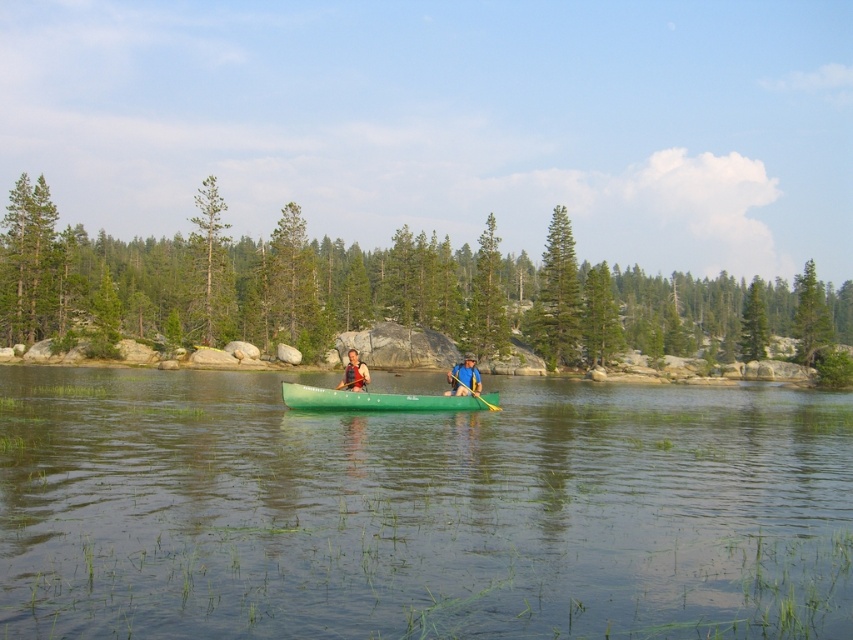
Question: Does green plastic canoe at center come in front of matte green canoe at center?

Choices:
 (A) yes
 (B) no

Answer: (B)

Question: Where is clear water at center located in relation to green plastic canoe at center in the image?

Choices:
 (A) right
 (B) left

Answer: (A)

Question: Which point is farther from the camera taking this photo?

Choices:
 (A) (354, 364)
 (B) (456, 388)

Answer: (B)

Question: Does green plastic canoe at center have a smaller size compared to matte green canoe at center?

Choices:
 (A) no
 (B) yes

Answer: (B)

Question: Which point is closer to the camera taking this photo?

Choices:
 (A) (165, 403)
 (B) (405, 408)
 (C) (354, 349)
 (D) (469, 381)

Answer: (B)

Question: Which of the following is the closest to the observer?

Choices:
 (A) (494, 404)
 (B) (364, 365)
 (C) (433, 397)

Answer: (B)